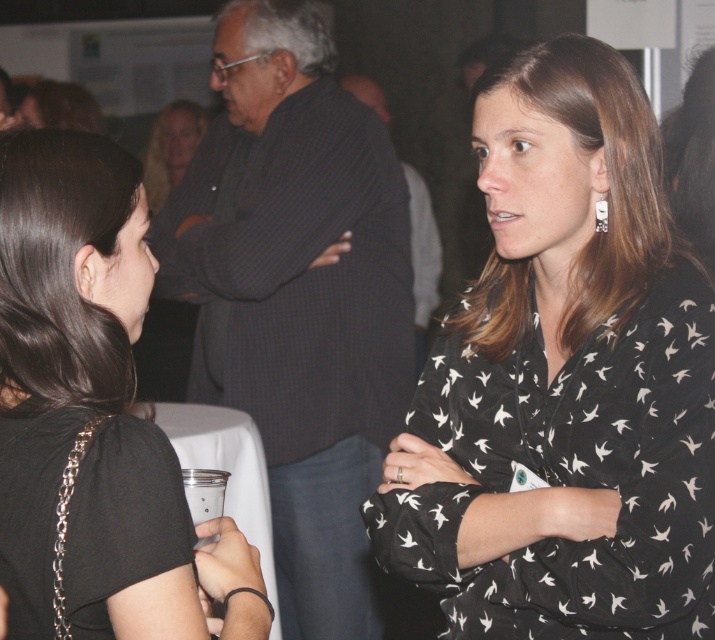
Question: Which object is positioned farthest from the matte black shirt at upper center?

Choices:
 (A) black printed blouse at center
 (B) clear plastic cup at lower center

Answer: (B)

Question: Which point is farther from the camera taking this photo?

Choices:
 (A) (626, 90)
 (B) (217, 312)
 (C) (177, 170)

Answer: (C)

Question: Is matte black shirt at upper center positioned in front of clear plastic cup at lower center?

Choices:
 (A) yes
 (B) no

Answer: (B)

Question: Based on their relative distances, which object is nearer to the black printed blouse at center?

Choices:
 (A) dark gray checkered shirt at center
 (B) clear plastic cup at lower center
 (C) black matte shirt at left

Answer: (B)

Question: Does black printed blouse at center have a greater width compared to black matte shirt at left?

Choices:
 (A) no
 (B) yes

Answer: (B)

Question: Is black printed blouse at center to the left of matte black shirt at upper center from the viewer's perspective?

Choices:
 (A) no
 (B) yes

Answer: (A)